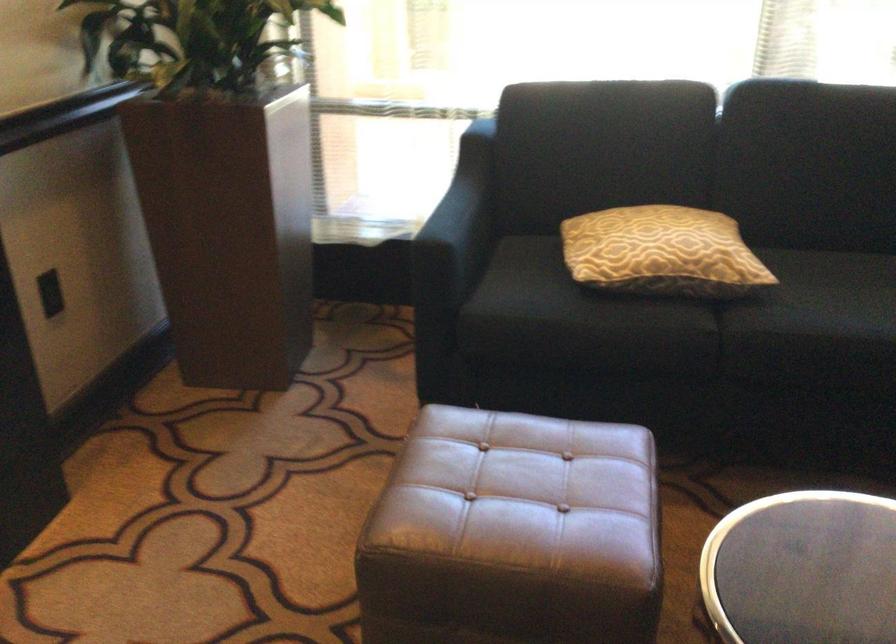
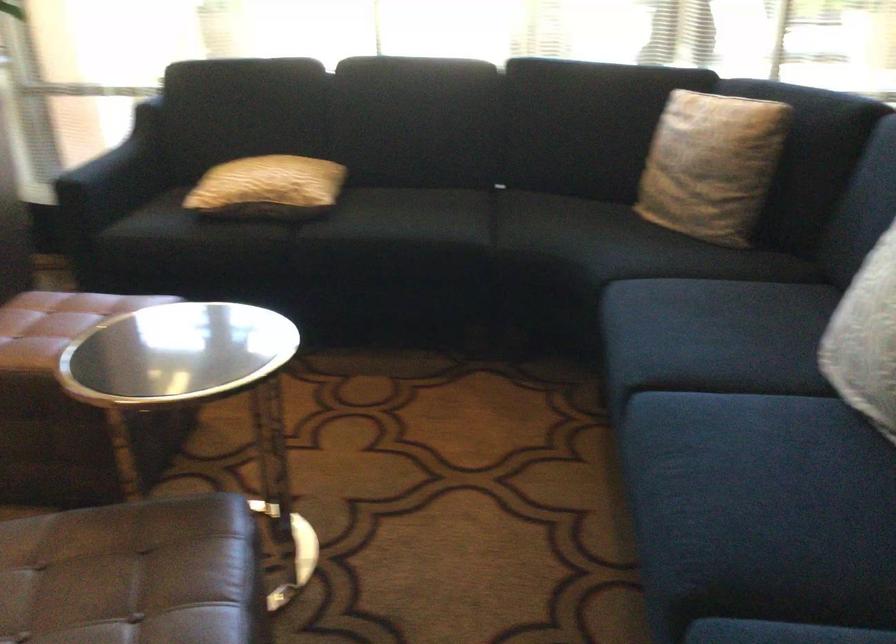
In the second image, find the point that corresponds to (x=684, y=260) in the first image.

(268, 187)